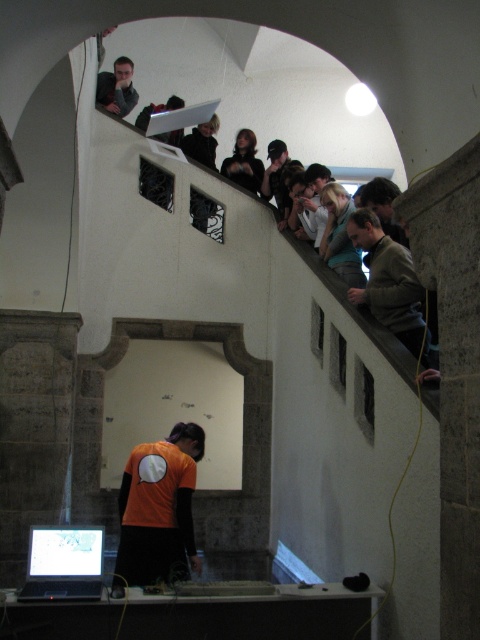
In the scene shown: Can you confirm if dark gray sweater at upper right is thinner than matte black laptop at lower left?

Incorrect, dark gray sweater at upper right's width is not less than matte black laptop at lower left's.

How much distance is there between dark gray sweater at upper right and matte black laptop at lower left?

dark gray sweater at upper right and matte black laptop at lower left are 2.27 meters apart from each other.

Is point (374, 307) closer to viewer compared to point (32, 577)?

No, it is not.

The image size is (480, 640). In order to click on dark gray sweater at upper right in this screenshot , I will do `click(389, 284)`.

Is point (31, 588) in front of point (104, 88)?

Yes, point (31, 588) is closer to viewer.

Which is in front, point (48, 573) or point (126, 102)?

Point (48, 573) is in front.

Is point (39, 582) less distant than point (98, 99)?

Yes, point (39, 582) is in front of point (98, 99).

Identify the location of matte black laptop at lower left. (63, 564).

Can you confirm if orange jersey at lower center is taller than dark gray sweater at upper right?

No, orange jersey at lower center is not taller than dark gray sweater at upper right.

Does orange jersey at lower center have a lesser width compared to dark gray sweater at upper right?

Incorrect, orange jersey at lower center's width is not less than dark gray sweater at upper right's.

Locate an element on the screen. This screenshot has width=480, height=640. orange jersey at lower center is located at coordinates [158, 508].

This screenshot has width=480, height=640. What are the coordinates of `orange jersey at lower center` in the screenshot? It's located at (158, 508).